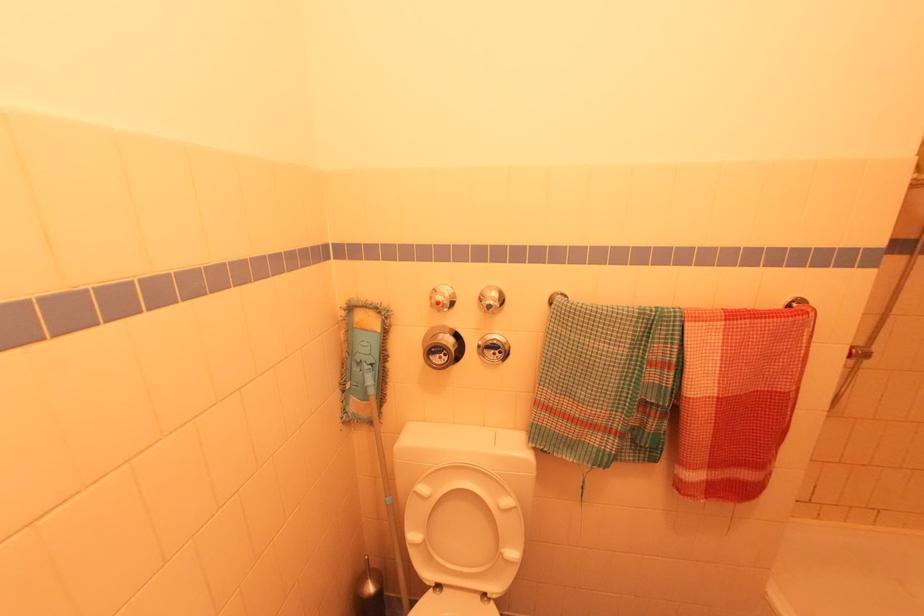
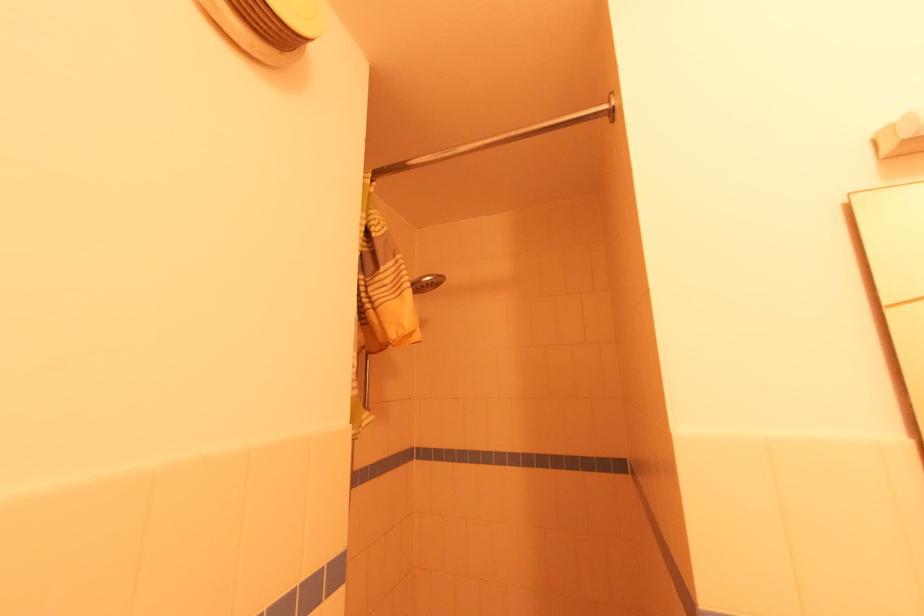
Based on the photo, the first image is from the beginning of the video and the second image is from the end. How did the camera likely rotate when shooting the video?

The camera's rotation is toward right-up.